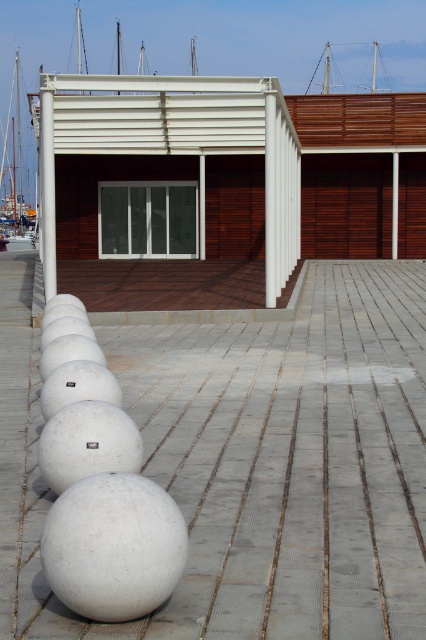
Can you confirm if transparent glass door at center is positioned below white glossy boat at left?

Yes, transparent glass door at center is below white glossy boat at left.

Who is positioned more to the left, transparent glass door at center or white glossy boat at left?

Positioned to the left is white glossy boat at left.

Find the location of a particular element. transparent glass door at center is located at coordinates (147, 220).